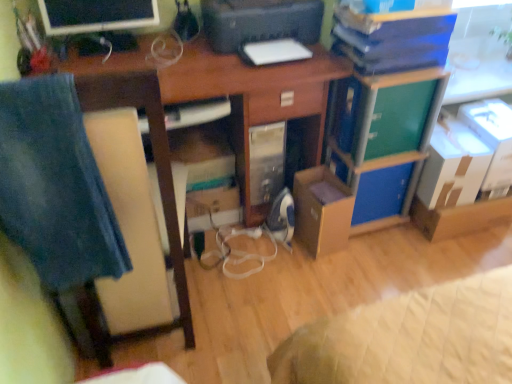
Measure the distance between blue cardboard box at center-right and camera.

blue cardboard box at center-right and camera are 1.69 meters apart.

In order to face black plastic printer at upper center, should I rotate leftwards or rightwards?

Rotate your view right by about 1.011°.

In order to face matte black monitor at upper left, should I rotate leftwards or rightwards?

To align with it, rotate left about 19.162°.

The height and width of the screenshot is (384, 512). I want to click on green plastic drawer at center-right, so click(399, 118).

The height and width of the screenshot is (384, 512). Describe the element at coordinates (399, 118) in the screenshot. I see `green plastic drawer at center-right` at that location.

Identify the location of brown cardboard box at center, arranged as the 1th cardboard box when viewed from the left. (322, 210).

How much space does brown cardboard box at lower right, which is the 3th cardboard box in left-to-right order, occupy horizontally?

brown cardboard box at lower right, which is the 3th cardboard box in left-to-right order, is 12.19 inches in width.

Locate an element on the screen. This screenshot has width=512, height=384. brown cardboard box at lower right, the second cardboard box viewed from the right is located at coordinates (460, 217).

Where is `white cardboard box at upper right, the fourth cardboard box from the left`? Image resolution: width=512 pixels, height=384 pixels. white cardboard box at upper right, the fourth cardboard box from the left is located at coordinates (492, 138).

Is green plastic drawer at center-right facing towards brown cardboard box at center, which appears as the 4th cardboard box when viewed from the right?

No, green plastic drawer at center-right does not turn towards brown cardboard box at center, which appears as the 4th cardboard box when viewed from the right.

At what (x,y) coordinates should I click in order to perform the action: click on the 3rd cardboard box positioned below the green plastic drawer at center-right (from a real-world perspective). Please return your answer as a coordinate pair (x, y). The image size is (512, 384). Looking at the image, I should click on (322, 210).

Does green plastic drawer at center-right have a larger size compared to brown cardboard box at center, arranged as the 1th cardboard box when viewed from the left?

Yes.

Is the surface of brown cardboard box at center, arranged as the 1th cardboard box when viewed from the left, in direct contact with wooden desk at center?

They are not placed beside each other.

In the scene shown: Can we say brown cardboard box at center, which appears as the 4th cardboard box when viewed from the right, lies outside wooden desk at center?

No.

Is brown cardboard box at center, arranged as the 1th cardboard box when viewed from the left, taller than wooden desk at center?

Incorrect, the height of brown cardboard box at center, arranged as the 1th cardboard box when viewed from the left, is not larger of that of wooden desk at center.

Could you measure the distance between brown cardboard box at center, which appears as the 4th cardboard box when viewed from the right, and wooden desk at center?

They are 14.82 inches apart.

Considering the relative sizes of green plastic drawer at center-right and wooden desk at center in the image provided, is green plastic drawer at center-right taller than wooden desk at center?

Incorrect, the height of green plastic drawer at center-right is not larger of that of wooden desk at center.

Considering the sizes of objects green plastic drawer at center-right and wooden desk at center in the image provided, who is smaller, green plastic drawer at center-right or wooden desk at center?

green plastic drawer at center-right.

From a real-world perspective, who is located lower, green plastic drawer at center-right or wooden desk at center?

wooden desk at center, from a real-world perspective.

Does point (375, 108) come behind point (313, 68)?

No, (375, 108) is in front of (313, 68).

Which is less distant, (440, 114) or (98, 26)?

Point (440, 114) appears to be farther away from the viewer than point (98, 26).

Is white cardboard box at right, arranged as the 2th cardboard box when viewed from the left, far away from matte black monitor at upper left?

That's right, there is a large distance between white cardboard box at right, arranged as the 2th cardboard box when viewed from the left, and matte black monitor at upper left.

Which of these two, white cardboard box at right, arranged as the 2th cardboard box when viewed from the left, or matte black monitor at upper left, is smaller?

matte black monitor at upper left.

From a real-world perspective, who is located lower, white cardboard box at right, arranged as the 2th cardboard box when viewed from the left, or black plastic printer at upper center?

In real-world perspective, white cardboard box at right, arranged as the 2th cardboard box when viewed from the left, is lower.

Based on the photo, how distant is white cardboard box at right, arranged as the 2th cardboard box when viewed from the left, from black plastic printer at upper center?

white cardboard box at right, arranged as the 2th cardboard box when viewed from the left, is 31.71 inches away from black plastic printer at upper center.

From the image's perspective, is white cardboard box at right, the third cardboard box in the right-to-left sequence, above or below black plastic printer at upper center?

Based on their image positions, white cardboard box at right, the third cardboard box in the right-to-left sequence, is located beneath black plastic printer at upper center.

Would you say white cardboard box at right, arranged as the 2th cardboard box when viewed from the left, is inside or outside black plastic printer at upper center?

white cardboard box at right, arranged as the 2th cardboard box when viewed from the left, is spatially situated outside black plastic printer at upper center.

Is blue cardboard box at center-right a part of wooden chair at left?

No, blue cardboard box at center-right is not a part of wooden chair at left.

Is wooden chair at left bigger or smaller than blue cardboard box at center-right?

Considering their sizes, wooden chair at left takes up more space than blue cardboard box at center-right.

Who is taller, wooden chair at left or blue cardboard box at center-right?

Standing taller between the two is wooden chair at left.

Considering the relative positions of wooden chair at left and blue cardboard box at center-right in the image provided, is wooden chair at left in front of blue cardboard box at center-right?

That is True.

From the image's perspective, relative to brown cardboard box at lower right, the second cardboard box viewed from the right, is wooden chair at left above or below?

Based on their image positions, wooden chair at left is located above brown cardboard box at lower right, the second cardboard box viewed from the right.

Would you consider wooden chair at left to be distant from brown cardboard box at lower right, which is the 3th cardboard box in left-to-right order?

Absolutely, wooden chair at left is distant from brown cardboard box at lower right, which is the 3th cardboard box in left-to-right order.

From a real-world perspective, which is physically below, wooden chair at left or brown cardboard box at lower right, the second cardboard box viewed from the right?

From a 3D spatial view, brown cardboard box at lower right, the second cardboard box viewed from the right, is below.

The height and width of the screenshot is (384, 512). Identify the location of cardboard box that is the 3rd object directly below the green plastic drawer at center-right (from a real-world perspective). point(322,210).

Identify the location of desk on the left of brown cardboard box at center, which appears as the 4th cardboard box when viewed from the right. The height and width of the screenshot is (384, 512). (234, 86).

Which object lies nearer to the anchor point wooden chair at left, blue cardboard box at center-right or brown cardboard box at center, which appears as the 4th cardboard box when viewed from the right?

brown cardboard box at center, which appears as the 4th cardboard box when viewed from the right.

Which object lies nearer to the anchor point wooden desk at center, wooden chair at left or matte black monitor at upper left?

matte black monitor at upper left.

Estimate the real-world distances between objects in this image. Which object is closer to white cardboard box at right, arranged as the 2th cardboard box when viewed from the left, green matte file cabinet at center-right or white cardboard box at upper right, which ranks as the first cardboard box in right-to-left order?

white cardboard box at upper right, which ranks as the first cardboard box in right-to-left order, lies closer to white cardboard box at right, arranged as the 2th cardboard box when viewed from the left, than the other object.

Which object lies further to the anchor point wooden desk at center, black plastic printer at upper center or brown cardboard box at lower right, which is the 3th cardboard box in left-to-right order?

Based on the image, brown cardboard box at lower right, which is the 3th cardboard box in left-to-right order, appears to be further to wooden desk at center.

Based on their spatial positions, is white cardboard box at right, arranged as the 2th cardboard box when viewed from the left, or wooden chair at left further from white cardboard box at upper right, which ranks as the first cardboard box in right-to-left order?

Based on the image, wooden chair at left appears to be further to white cardboard box at upper right, which ranks as the first cardboard box in right-to-left order.

Estimate the real-world distances between objects in this image. Which object is further from brown cardboard box at lower right, the second cardboard box viewed from the right, green plastic drawer at center-right or white cardboard box at upper right, the fourth cardboard box from the left?

Based on the image, green plastic drawer at center-right appears to be further to brown cardboard box at lower right, the second cardboard box viewed from the right.

Which object lies further to the anchor point brown cardboard box at lower right, the second cardboard box viewed from the right, green plastic drawer at center-right or brown cardboard box at center, which appears as the 4th cardboard box when viewed from the right?

The object further to brown cardboard box at lower right, the second cardboard box viewed from the right, is brown cardboard box at center, which appears as the 4th cardboard box when viewed from the right.

Considering their positions, is brown cardboard box at lower right, the second cardboard box viewed from the right, positioned further to blue cardboard box at center-right than white cardboard box at right, the third cardboard box in the right-to-left sequence?

Among the two, brown cardboard box at lower right, the second cardboard box viewed from the right, is located further to blue cardboard box at center-right.

Find the location of `desk between black plastic printer at upper center and brown cardboard box at center, which appears as the 4th cardboard box when viewed from the right, in the up-down direction`. desk between black plastic printer at upper center and brown cardboard box at center, which appears as the 4th cardboard box when viewed from the right, in the up-down direction is located at coordinates (234, 86).

Identify the location of storage box between green plastic drawer at center-right and white cardboard box at upper right, which ranks as the first cardboard box in right-to-left order. This screenshot has height=384, width=512. (381, 192).

Identify the location of storage box located between wooden chair at left and white cardboard box at right, the third cardboard box in the right-to-left sequence, in the left-right direction. The image size is (512, 384). (381, 192).

Identify the location of printer between matte black monitor at upper left and white cardboard box at right, the third cardboard box in the right-to-left sequence, in the horizontal direction. Image resolution: width=512 pixels, height=384 pixels. (260, 22).